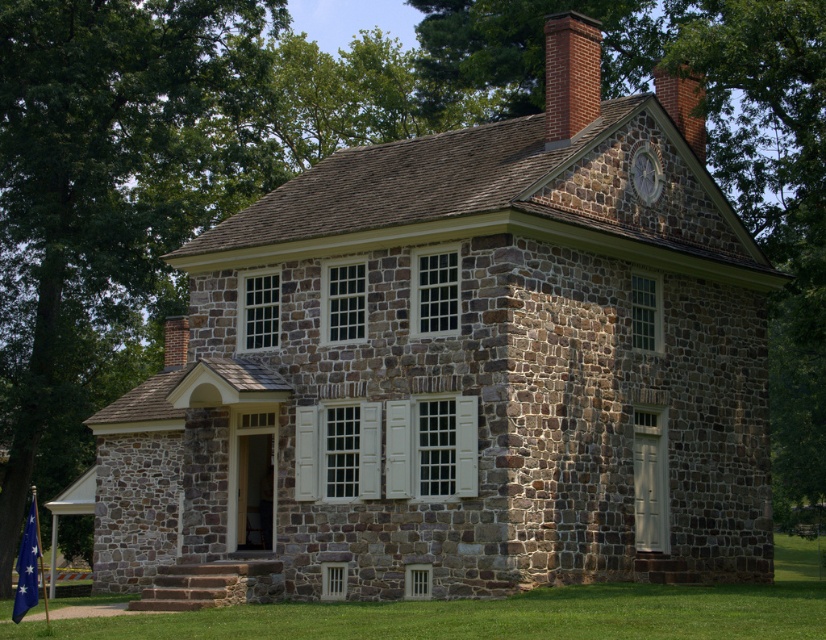
Question: Can you confirm if green leafy tree at upper left is positioned above blue fabric flag at lower left?

Choices:
 (A) yes
 (B) no

Answer: (A)

Question: Observing the image, what is the correct spatial positioning of brown stone wall at center in reference to stone clock at upper center?

Choices:
 (A) above
 (B) below

Answer: (A)

Question: Observing the image, what is the correct spatial positioning of green leafy tree at upper left in reference to brick chimney at upper center?

Choices:
 (A) above
 (B) below

Answer: (B)

Question: Among these points, which one is nearest to the camera?

Choices:
 (A) (686, 128)
 (B) (121, 230)
 (C) (17, 588)
 (D) (578, 109)

Answer: (C)

Question: Which object appears farthest from the camera in this image?

Choices:
 (A) brick chimney at upper right
 (B) green leafy tree at upper left
 (C) stone clock at upper center
 (D) brown stone wall at center

Answer: (B)

Question: Which of the following is the closest to the observer?

Choices:
 (A) brown stone wall at center
 (B) brick chimney at upper center
 (C) green leafy tree at upper left

Answer: (B)